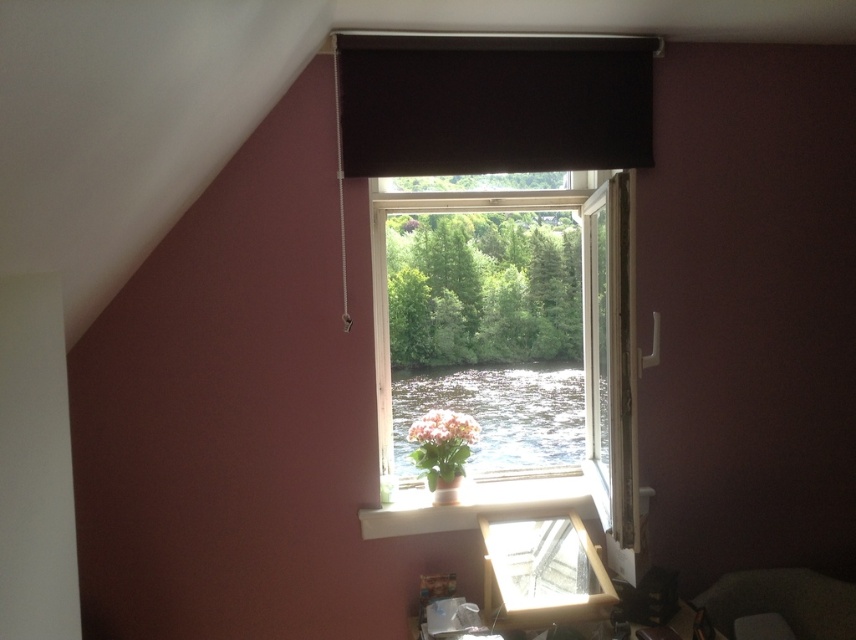
Does transparent glass window at center have a greater height compared to matte white vase at center?

Indeed, transparent glass window at center has a greater height compared to matte white vase at center.

Who is more forward, (393, 355) or (458, 484)?

Point (458, 484) is in front.

Identify the location of transparent glass window at center. The image size is (856, 640). coord(513,355).

Does dark matte curtain at upper center have a lesser width compared to matte pink flower at center?

No.

Is dark matte curtain at upper center taller than matte pink flower at center?

Yes.

I want to click on dark matte curtain at upper center, so pos(492,104).

Locate an element on the screen. dark matte curtain at upper center is located at coordinates (492, 104).

Is matte pink flower at center taller than matte white vase at center?

Indeed, matte pink flower at center has a greater height compared to matte white vase at center.

Between point (438, 456) and point (443, 492), which one is positioned in front?

Point (443, 492) is more forward.

Where is `matte pink flower at center`? The width and height of the screenshot is (856, 640). matte pink flower at center is located at coordinates (441, 444).